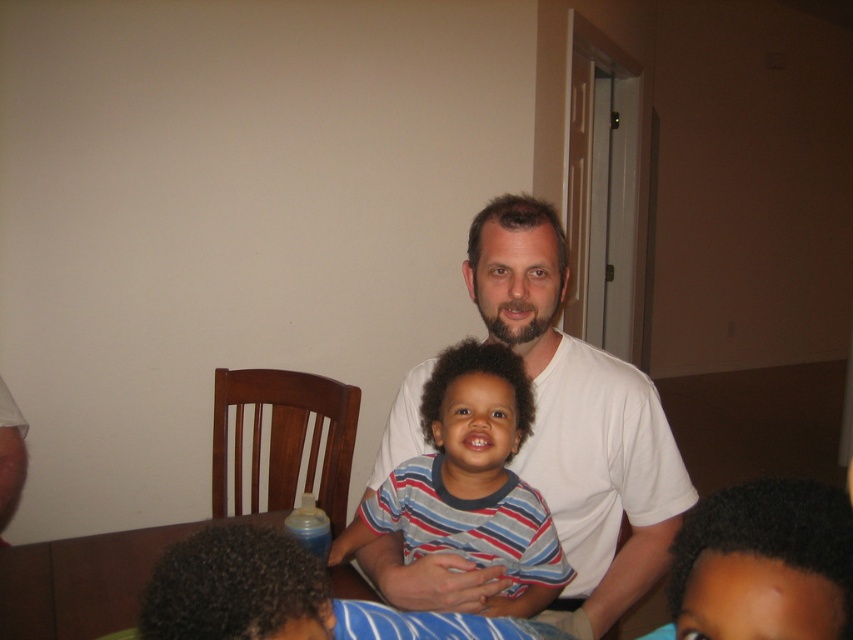
You are standing in the dining area and want to place a decorative plate on the table. The plate needs to be placed exactly where the striped cotton shirt at center is currently located. According to the coordinates provided, where should you place the plate?

The striped cotton shirt at center is located at point (469, 483), so you should place the decorative plate at those coordinates on the table.

You are standing in the dining area and want to walk from point A to point B. Point A is at coordinates point (407, 419) and point B is at coordinates point (498, 477). Which direction should you move to go from point A to point B?

To move from point A at coordinates point (407, 419) to point B at coordinates point (498, 477), you should move forward since point A is behind point B according to the spatial relationship provided.